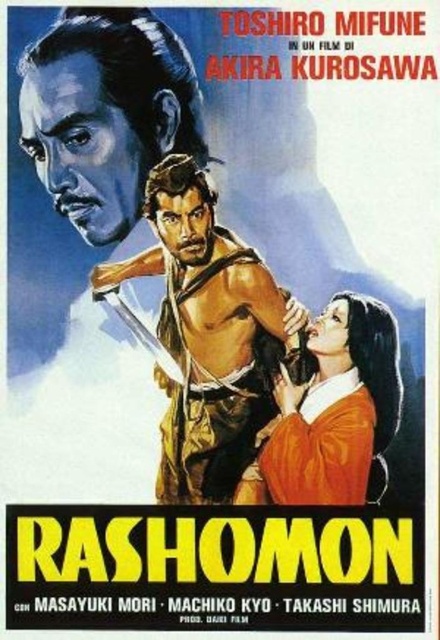
In the scene shown: Is the position of brown leather armor at center less distant than that of matte black face at upper left?

Yes, brown leather armor at center is in front of matte black face at upper left.

Between brown leather armor at center and matte black face at upper left, which one appears on the right side from the viewer's perspective?

brown leather armor at center is more to the right.

Find the location of a particular element. Image resolution: width=440 pixels, height=640 pixels. brown leather armor at center is located at coordinates (208, 333).

This screenshot has width=440, height=640. What do you see at coordinates (106, 113) in the screenshot? I see `matte black face at upper left` at bounding box center [106, 113].

This screenshot has height=640, width=440. Find the location of `matte black face at upper left`. matte black face at upper left is located at coordinates (106, 113).

Does brown leather armor at center lie in front of smooth orange kimono at lower right?

Yes, brown leather armor at center is closer to the viewer.

In the scene shown: Can you confirm if brown leather armor at center is positioned above smooth orange kimono at lower right?

Yes.

Does point (277, 349) come closer to viewer compared to point (315, 484)?

No, (277, 349) is behind (315, 484).

Where is `brown leather armor at center`? The width and height of the screenshot is (440, 640). brown leather armor at center is located at coordinates (208, 333).